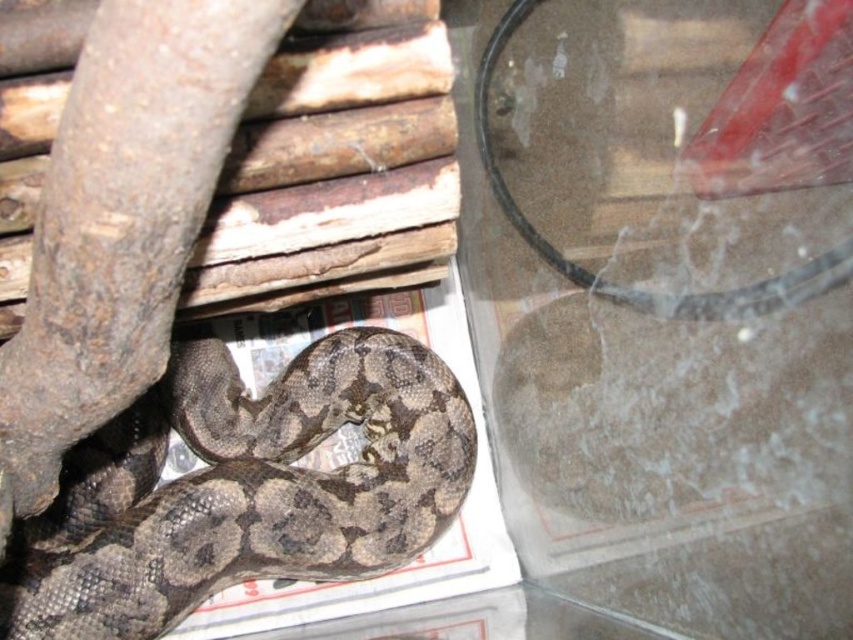
Question: Is transparent plastic glass at center bigger than brown textured snake at lower left?

Choices:
 (A) yes
 (B) no

Answer: (A)

Question: Which of the following is the closest to the observer?

Choices:
 (A) brown textured snake at lower left
 (B) transparent plastic glass at center

Answer: (B)

Question: Does transparent plastic glass at center have a greater width compared to brown textured snake at lower left?

Choices:
 (A) yes
 (B) no

Answer: (B)

Question: Which point is closer to the camera?

Choices:
 (A) brown textured snake at lower left
 (B) transparent plastic glass at center

Answer: (B)

Question: Is transparent plastic glass at center above brown textured snake at lower left?

Choices:
 (A) yes
 (B) no

Answer: (A)